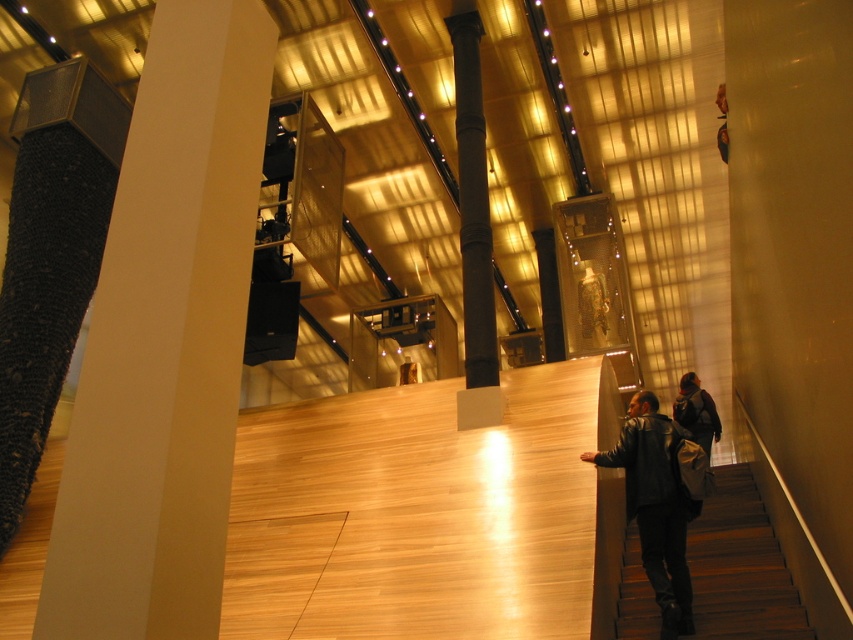
You are standing in the museum and want to determine the relative positions of two points marked in the image. Which point is nearer to you, point at coordinate [175,116] or point at coordinate [468,67]?

Point at coordinate [175,116] is closer to the viewer than point at coordinate [468,67].

You are an art curator planning to install a new spotlight on the ceiling above the white matte column at left and the black polished column at center. Since the spotlight can only illuminate one column at a time, which column should you aim it at to ensure the light reaches the column that is closer to the front of the space?

The white matte column at left is in front of the black polished column at center, so you should aim the spotlight at the white matte column at left to illuminate the closer column.

You are a visitor in the museum and you see the dark wood stairs at lower right and the dark leather jacket at lower right. Which object is located more to the right side?

The dark wood stairs at lower right is positioned on the right side of dark leather jacket at lower right, so the dark wood stairs at lower right is more to the right side.